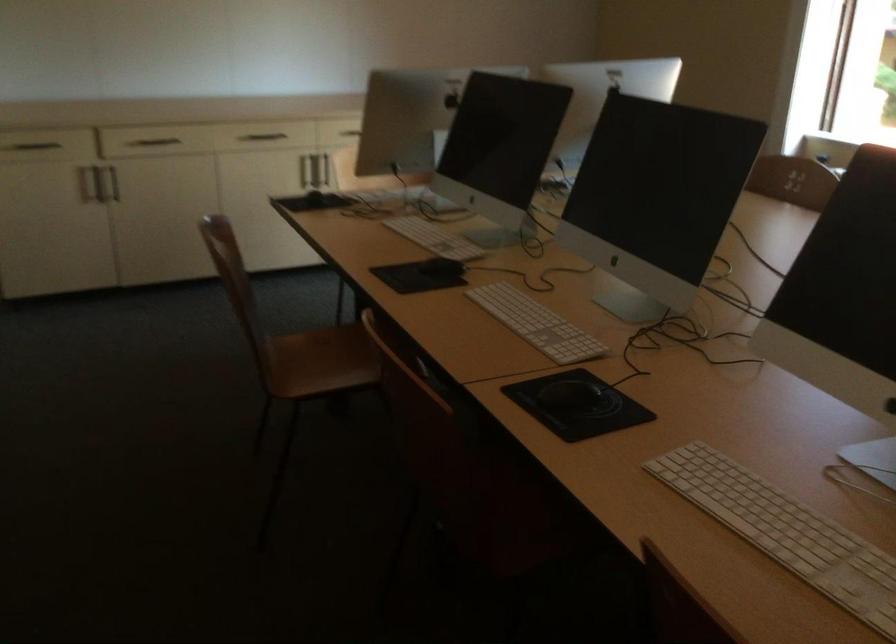
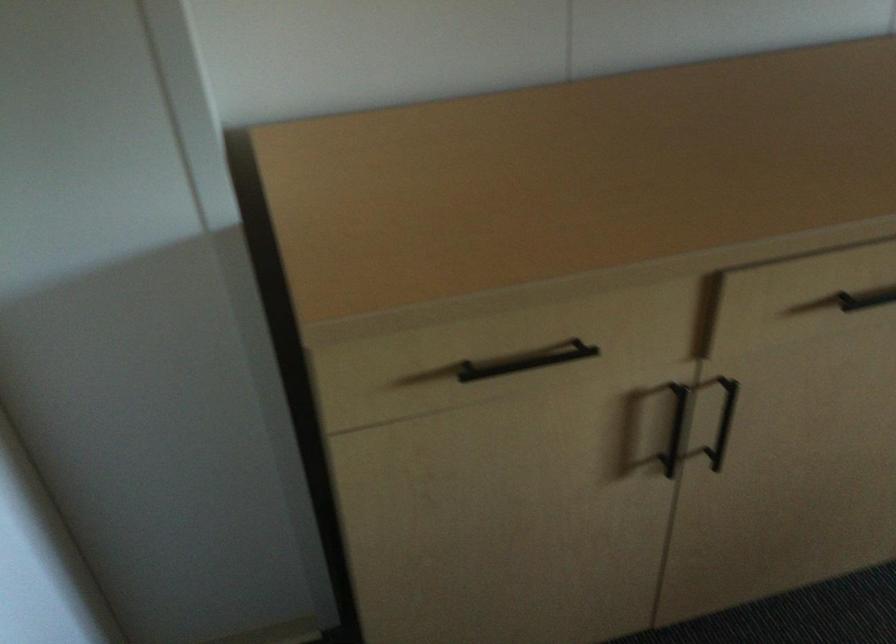
The point at (90, 175) is marked in the first image. Where is the corresponding point in the second image?

(675, 428)